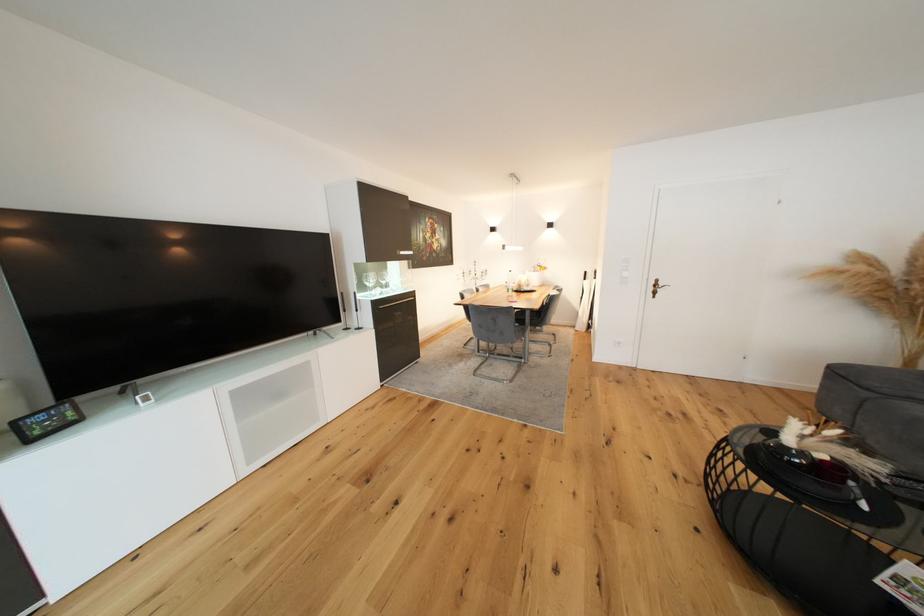
The image size is (924, 616). What are the coordinates of `grey chair sitting surface` in the screenshot? It's located at (518, 330).